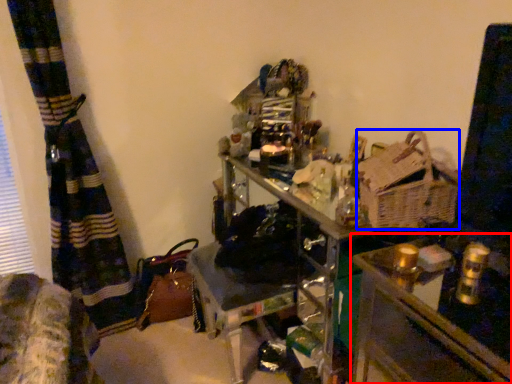
Question: Which object is further to the camera taking this photo, table (highlighted by a red box) or basket (highlighted by a blue box)?

Choices:
 (A) table
 (B) basket

Answer: (B)